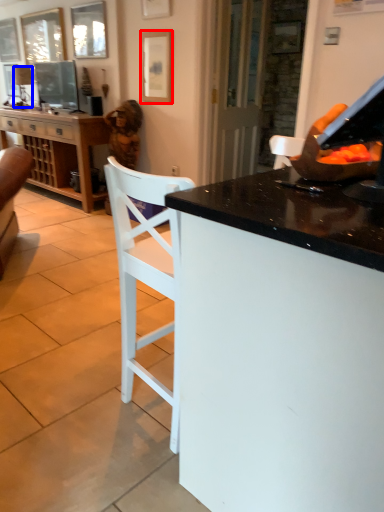
Question: Which of the following is the closest to the observer, picture frame (highlighted by a red box) or lamp (highlighted by a blue box)?

Choices:
 (A) picture frame
 (B) lamp

Answer: (A)